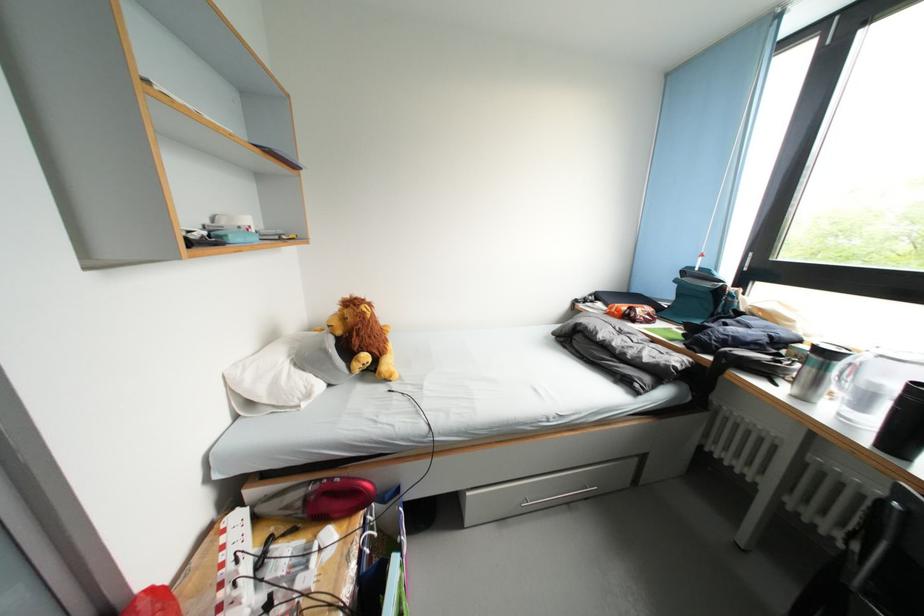
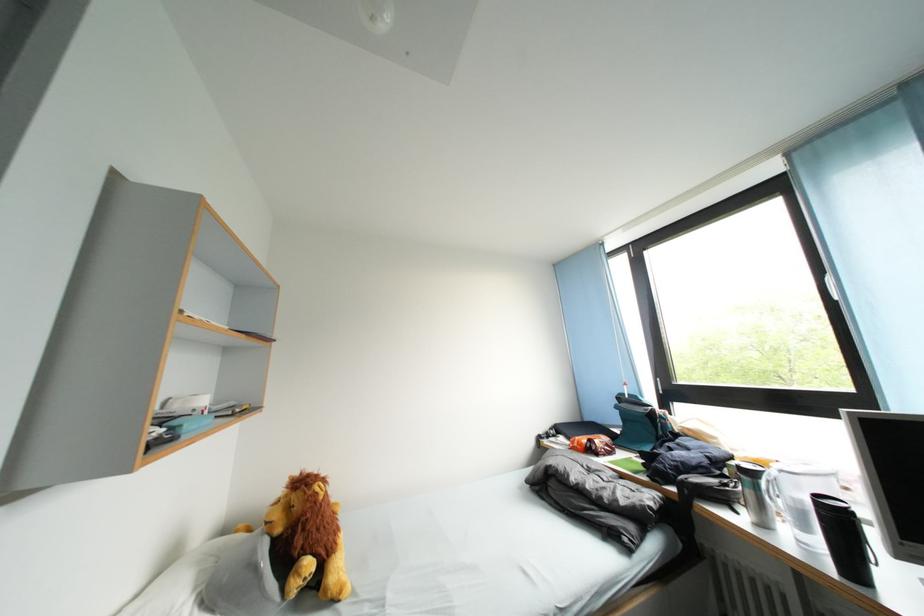
Where in the second image is the point corresponding to point (637, 322) from the first image?

(600, 455)